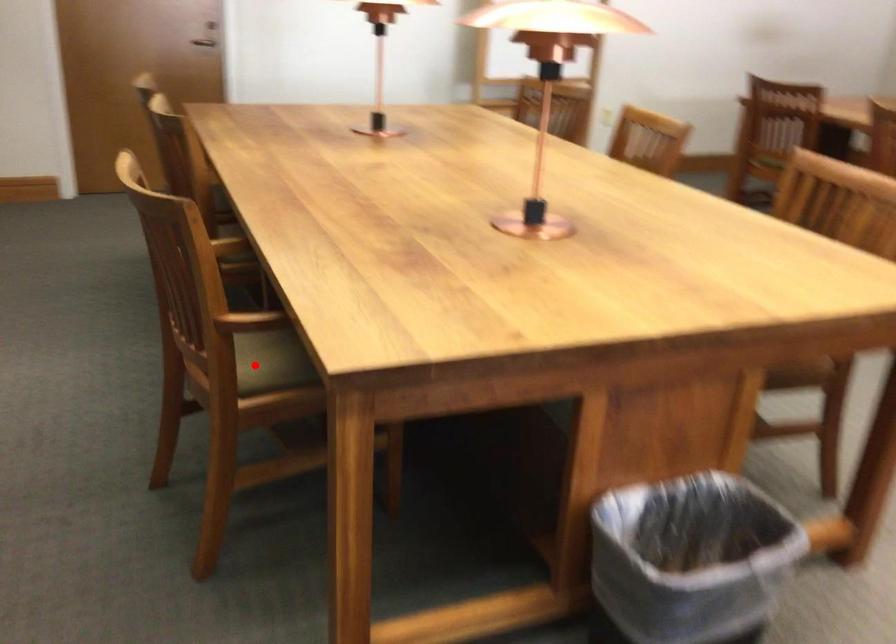
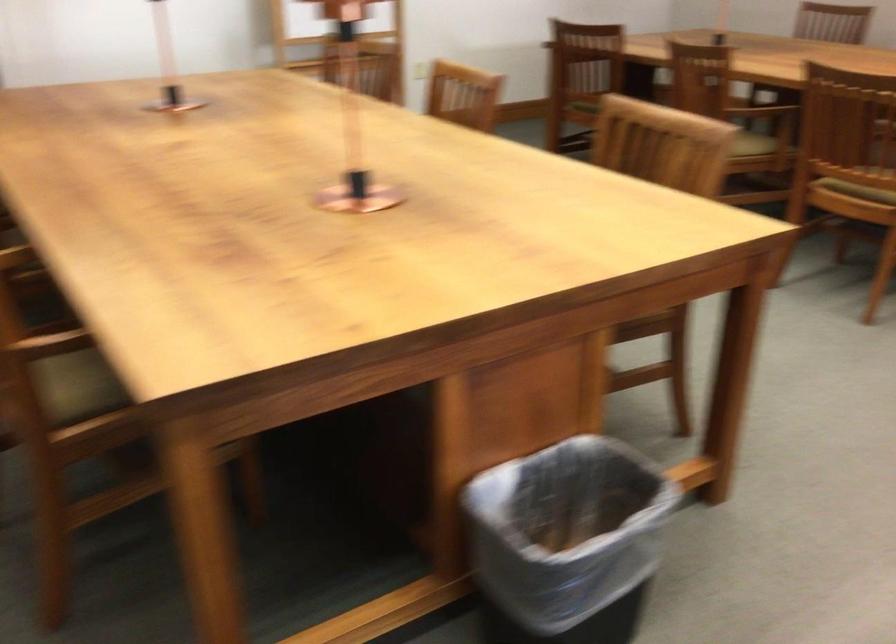
Find the pixel in the second image that matches the highlighted location in the first image.

(76, 386)